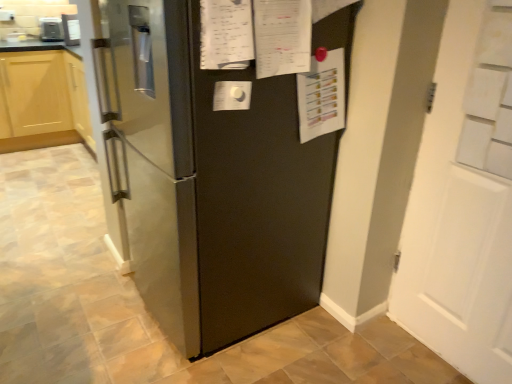
Question: Is satin black refrigerator at center at the back of satin silver toaster at upper left, which appears as the 1th appliance when viewed from the back?

Choices:
 (A) no
 (B) yes

Answer: (A)

Question: From the image's perspective, is satin silver toaster at upper left, which appears as the 1th appliance when viewed from the back, on top of satin black refrigerator at center?

Choices:
 (A) yes
 (B) no

Answer: (A)

Question: Is satin silver toaster at upper left, acting as the 2th appliance starting from the right, not within satin black refrigerator at center?

Choices:
 (A) yes
 (B) no

Answer: (A)

Question: Would you consider satin silver toaster at upper left, which appears as the 1th appliance when viewed from the back, to be distant from satin black refrigerator at center?

Choices:
 (A) no
 (B) yes

Answer: (B)

Question: Is satin silver toaster at upper left, which appears as the 1th appliance when viewed from the back, in front of satin black refrigerator at center?

Choices:
 (A) yes
 (B) no

Answer: (B)

Question: Is satin silver toaster at upper left, which appears as the 1th appliance when viewed from the back, next to satin black refrigerator at center?

Choices:
 (A) no
 (B) yes

Answer: (A)

Question: From the image's perspective, is white matte door at right above satin black refrigerator at center?

Choices:
 (A) no
 (B) yes

Answer: (A)

Question: Is the depth of white matte door at right less than that of satin black refrigerator at center?

Choices:
 (A) yes
 (B) no

Answer: (A)

Question: Considering the relative sizes of white matte door at right and satin black refrigerator at center in the image provided, is white matte door at right thinner than satin black refrigerator at center?

Choices:
 (A) yes
 (B) no

Answer: (A)

Question: Would you say white matte door at right contains satin black refrigerator at center?

Choices:
 (A) no
 (B) yes

Answer: (A)

Question: Does white matte door at right appear on the right side of satin black refrigerator at center?

Choices:
 (A) yes
 (B) no

Answer: (A)

Question: Is white matte door at right bigger than satin black refrigerator at center?

Choices:
 (A) no
 (B) yes

Answer: (A)

Question: Is white matte door at right shorter than satin silver toaster at upper left, which is the second appliance from front to back?

Choices:
 (A) yes
 (B) no

Answer: (B)